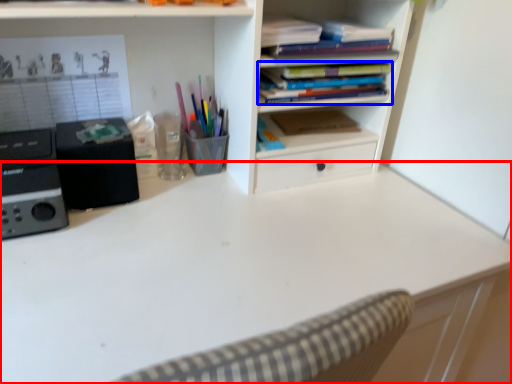
Question: Among these objects, which one is farthest to the camera, desk (highlighted by a red box) or book (highlighted by a blue box)?

Choices:
 (A) desk
 (B) book

Answer: (B)